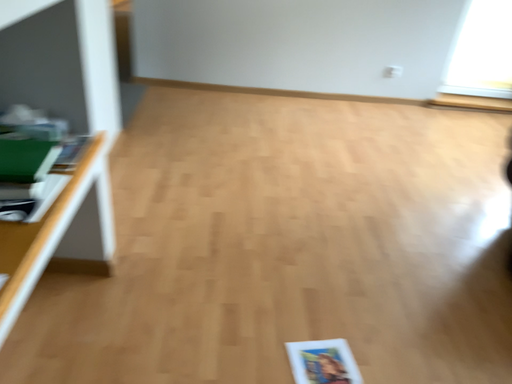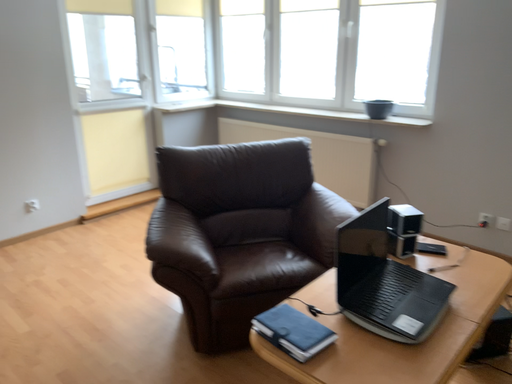
Question: How did the camera likely rotate when shooting the video?

Choices:
 (A) rotated downward
 (B) rotated upward

Answer: (B)